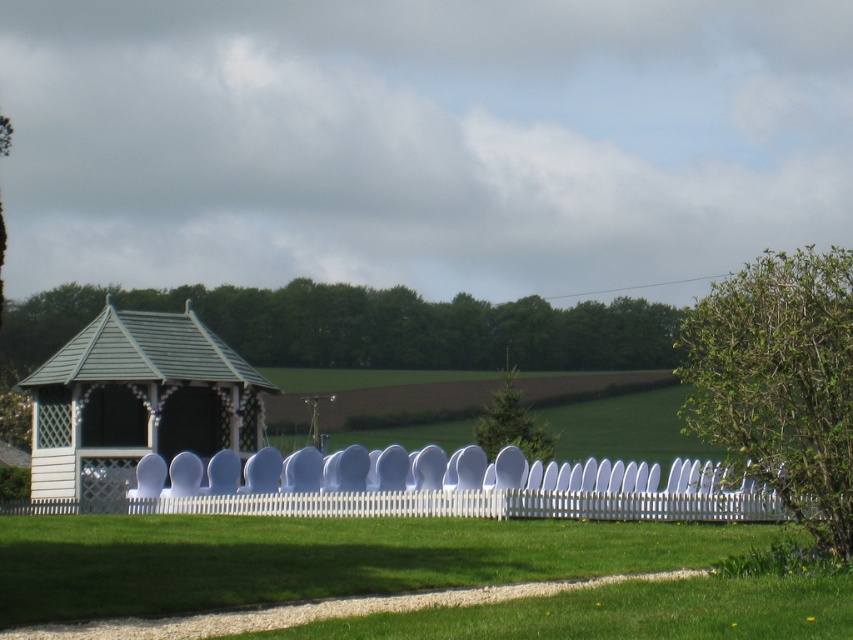
Is point (579, 474) more distant than point (115, 476)?

No, it is not.

Can you confirm if white picket fence at center is smaller than white wood gazebo at left?

Actually, white picket fence at center might be larger than white wood gazebo at left.

Which is behind, point (512, 506) or point (47, 417)?

Point (47, 417)

I want to click on white picket fence at center, so click(444, 486).

Who is lower down, green grass at lower center or white picket fence at center?

Positioned lower is white picket fence at center.

In the scene shown: Can you confirm if green grass at lower center is wider than white picket fence at center?

In fact, green grass at lower center might be narrower than white picket fence at center.

Does point (453, 573) lie in front of point (257, 468)?

Yes, point (453, 573) is in front of point (257, 468).

The image size is (853, 640). Identify the location of green grass at lower center. click(x=316, y=557).

Looking at this image, is green grass at lower center further to camera compared to white wood gazebo at left?

No, it is in front of white wood gazebo at left.

The image size is (853, 640). What do you see at coordinates (316, 557) in the screenshot?
I see `green grass at lower center` at bounding box center [316, 557].

In order to click on green grass at lower center in this screenshot , I will do `click(316, 557)`.